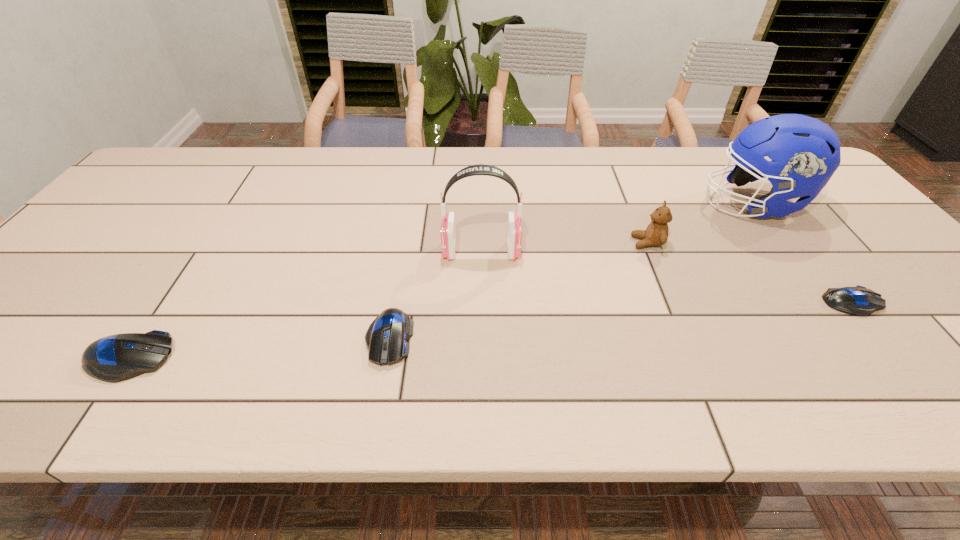
The width and height of the screenshot is (960, 540). I want to click on the leftmost object, so click(115, 358).

Locate an element on the screen. The image size is (960, 540). the second object from left to right is located at coordinates (386, 338).

Identify the location of the second shortest computer mouse. The height and width of the screenshot is (540, 960). (386, 338).

Identify the location of the rightmost computer mouse. The height and width of the screenshot is (540, 960). (860, 301).

Find the location of a particular element. The width and height of the screenshot is (960, 540). the shortest object is located at coordinates (860, 301).

Identify the location of the farthest object. The height and width of the screenshot is (540, 960). (805, 152).

The width and height of the screenshot is (960, 540). I want to click on the fourth object from right to left, so click(514, 227).

Where is `teddy bear`? This screenshot has height=540, width=960. teddy bear is located at coordinates (656, 234).

Identify the location of the third object from right to left. (656, 234).

This screenshot has width=960, height=540. I want to click on vacant space located 0.140m on the button side of the leftmost computer mouse, so click(243, 358).